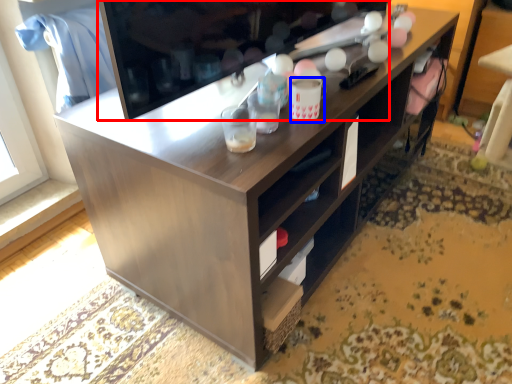
Question: Which of the following is the farthest to the observer, television (highlighted by a red box) or beverage (highlighted by a blue box)?

Choices:
 (A) television
 (B) beverage

Answer: (B)